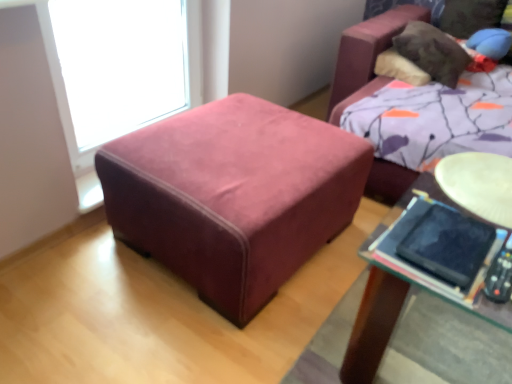
Find the location of a particular element. free spot in front of velvet ottoman at center is located at coordinates (220, 337).